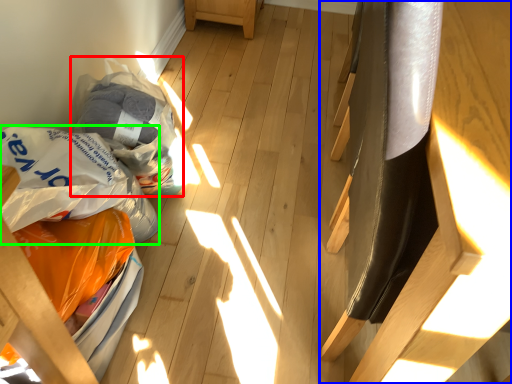
Question: Based on their relative distances, which object is nearer to grocery bag (highlighted by a red box)? Choose from furniture (highlighted by a blue box) and grocery bag (highlighted by a green box).

Choices:
 (A) furniture
 (B) grocery bag

Answer: (B)